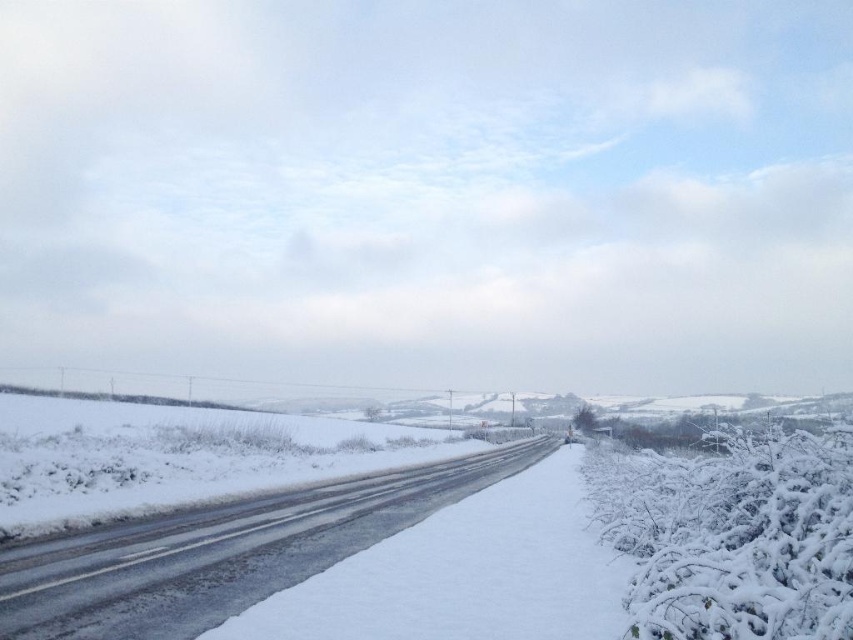
Does white frosty shrub at right have a lesser width compared to glossy asphalt highway at center?

Yes, white frosty shrub at right is thinner than glossy asphalt highway at center.

Is point (668, 547) positioned behind point (339, 492)?

No.

Does point (637, 605) lie in front of point (228, 580)?

Yes, point (637, 605) is closer to viewer.

In order to click on white frosty shrub at right in this screenshot , I will do `click(733, 536)`.

Does glossy asphalt highway at center have a greater height compared to white frosty bush at right?

Yes, glossy asphalt highway at center is taller than white frosty bush at right.

Image resolution: width=853 pixels, height=640 pixels. What do you see at coordinates (222, 552) in the screenshot?
I see `glossy asphalt highway at center` at bounding box center [222, 552].

Between point (59, 595) and point (590, 422), which one is positioned in front?

Positioned in front is point (59, 595).

Locate an element on the screen. The height and width of the screenshot is (640, 853). glossy asphalt highway at center is located at coordinates (222, 552).

Who is lower down, white frosty shrub at right or white frosty bush at right?

white frosty bush at right is below.

Who is higher up, white frosty shrub at right or white frosty bush at right?

white frosty shrub at right is higher up.

Between point (782, 484) and point (579, 429), which one is positioned behind?

The point (579, 429) is behind.

At what (x,y) coordinates should I click in order to perform the action: click on white frosty shrub at right. Please return your answer as a coordinate pair (x, y). Looking at the image, I should click on (733, 536).